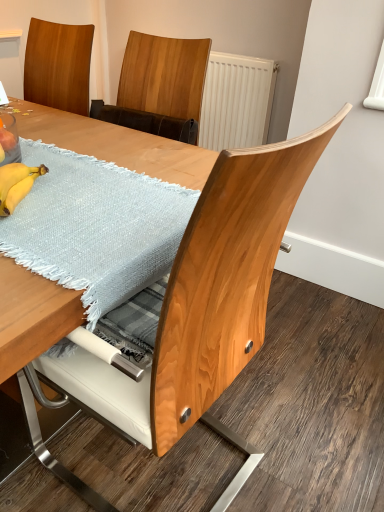
Question: In which direction should I rotate to look at wooden table at center, the 1th table in the bottom-to-top sequence?

Choices:
 (A) right
 (B) left

Answer: (B)

Question: Is yellow matte bananas at lower left next to light blue woven placemat at upper left, acting as the 1th table starting from the top?

Choices:
 (A) no
 (B) yes

Answer: (A)

Question: From a real-world perspective, is yellow matte bananas at lower left located beneath light blue woven placemat at upper left, acting as the 1th table starting from the top?

Choices:
 (A) yes
 (B) no

Answer: (B)

Question: From the image's perspective, is yellow matte bananas at lower left on light blue woven placemat at upper left, acting as the 1th table starting from the top?

Choices:
 (A) yes
 (B) no

Answer: (B)

Question: Considering the relative positions of yellow matte bananas at lower left and light blue woven placemat at upper left, positioned as the 2th table in bottom-to-top order, in the image provided, is yellow matte bananas at lower left to the right of light blue woven placemat at upper left, positioned as the 2th table in bottom-to-top order, from the viewer's perspective?

Choices:
 (A) no
 (B) yes

Answer: (A)

Question: Is the depth of yellow matte bananas at lower left greater than that of light blue woven placemat at upper left, acting as the 1th table starting from the top?

Choices:
 (A) yes
 (B) no

Answer: (A)

Question: Is yellow matte bananas at lower left wider than light blue woven placemat at upper left, positioned as the 2th table in bottom-to-top order?

Choices:
 (A) yes
 (B) no

Answer: (B)

Question: From a real-world perspective, is light blue woven placemat at upper left, acting as the 1th table starting from the top, located higher than wooden table at center, the second table when ordered from top to bottom?

Choices:
 (A) yes
 (B) no

Answer: (A)

Question: Is light blue woven placemat at upper left, positioned as the 2th table in bottom-to-top order, positioned in front of wooden table at center, the second table when ordered from top to bottom?

Choices:
 (A) yes
 (B) no

Answer: (B)

Question: Could wooden table at center, the second table when ordered from top to bottom, be considered to be inside light blue woven placemat at upper left, positioned as the 2th table in bottom-to-top order?

Choices:
 (A) yes
 (B) no

Answer: (B)

Question: Is light blue woven placemat at upper left, acting as the 1th table starting from the top, thinner than wooden table at center, the 1th table in the bottom-to-top sequence?

Choices:
 (A) yes
 (B) no

Answer: (B)

Question: Is light blue woven placemat at upper left, acting as the 1th table starting from the top, bigger than wooden table at center, the 1th table in the bottom-to-top sequence?

Choices:
 (A) no
 (B) yes

Answer: (A)

Question: Is light blue woven placemat at upper left, acting as the 1th table starting from the top, behind wooden table at center, the second table when ordered from top to bottom?

Choices:
 (A) no
 (B) yes

Answer: (B)

Question: Is wooden table at center, the second table when ordered from top to bottom, facing away from light blue woven placemat at upper left, acting as the 1th table starting from the top?

Choices:
 (A) yes
 (B) no

Answer: (B)